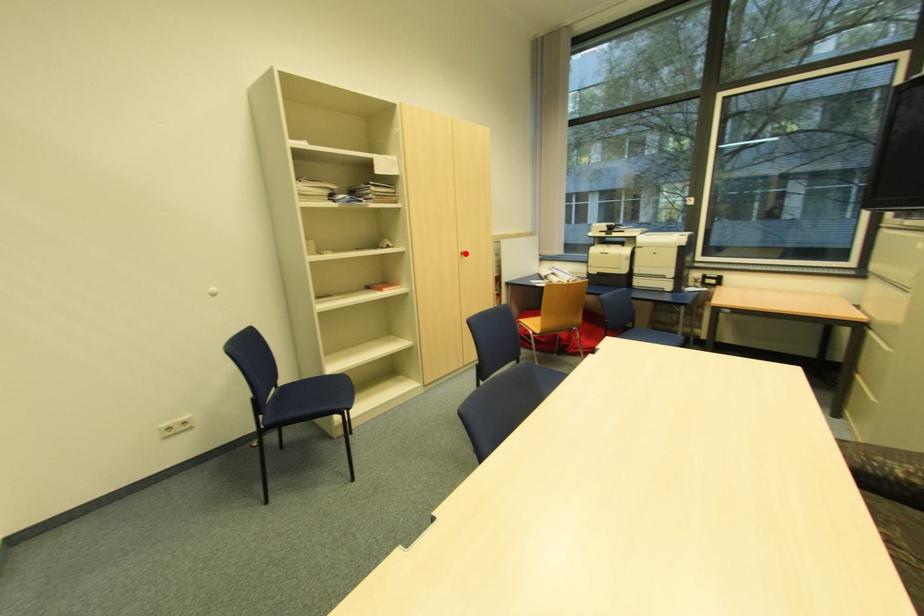
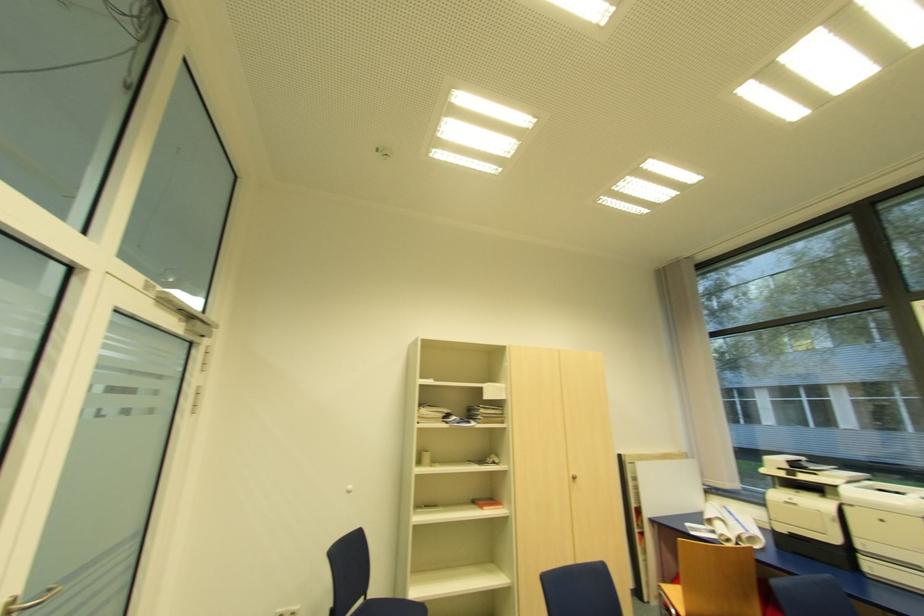
Where in the second image is the point corresponding to the highlighted location from the first image?

(576, 477)